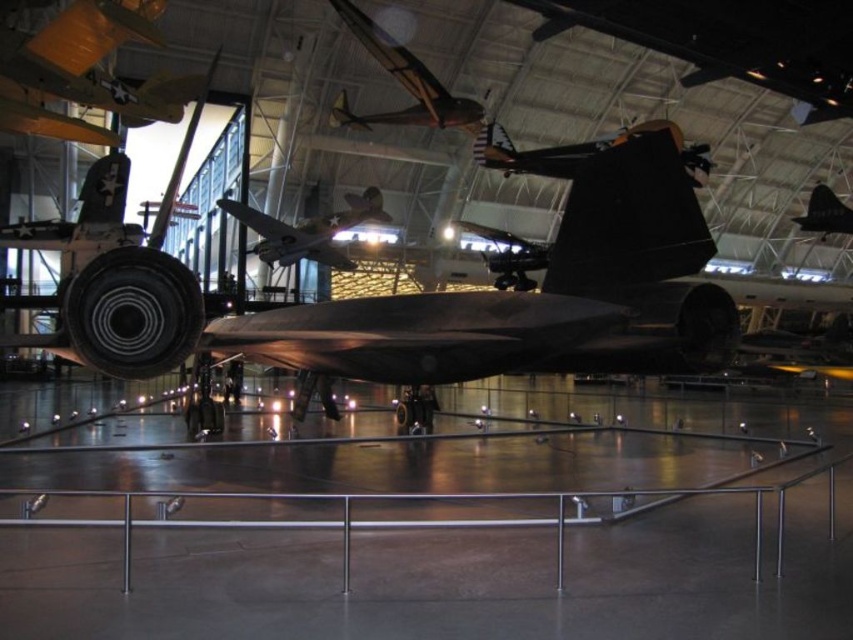
Question: Does shiny metallic airplane at upper center have a lesser width compared to shiny silver airplane at center?

Choices:
 (A) yes
 (B) no

Answer: (A)

Question: Is shiny black aircraft at center wider than shiny black airplane at center?

Choices:
 (A) no
 (B) yes

Answer: (B)

Question: Can you confirm if shiny metallic airplane at upper center is smaller than shiny silver airplane at center?

Choices:
 (A) no
 (B) yes

Answer: (B)

Question: Which object is closer to the camera taking this photo?

Choices:
 (A) shiny black aircraft at center
 (B) shiny silver airplane at center

Answer: (B)

Question: Which object is the closest to the shiny black aircraft at center?

Choices:
 (A) shiny metallic airplane at upper center
 (B) shiny silver airplane at center
 (C) shiny black airplane at center

Answer: (B)

Question: Which object appears closest to the camera in this image?

Choices:
 (A) shiny black aircraft at center
 (B) shiny silver airplane at center

Answer: (B)